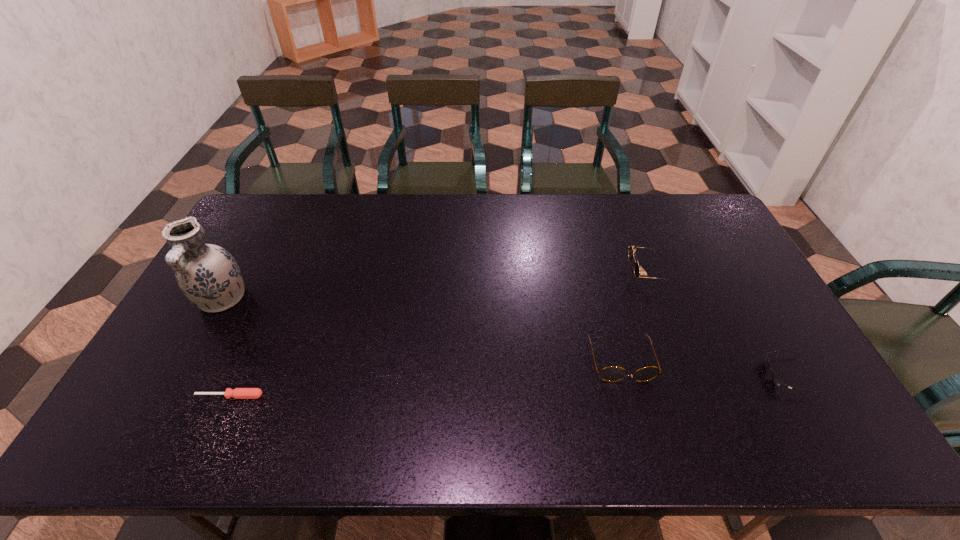
Find the location of a particular element. The width and height of the screenshot is (960, 540). free space at the near edge of the desktop is located at coordinates (204, 427).

In the image, there is a desktop. Identify the location of vacant space at the left edge. (168, 392).

The height and width of the screenshot is (540, 960). I want to click on free space at the right edge of the desktop, so click(x=686, y=244).

Where is `vacant region at the far right corner of the desktop`? The width and height of the screenshot is (960, 540). vacant region at the far right corner of the desktop is located at coordinates (702, 215).

I want to click on blank area at the near right corner, so click(847, 440).

Find the location of a particular element. This screenshot has width=960, height=540. empty location between the screwdriver and the leftmost sunglasses is located at coordinates (425, 378).

Identify the location of vacant point located between the screwdriver and the shortest sunglasses. (509, 386).

What are the coordinates of `free space between the screwdriver and the second shortest object` in the screenshot? It's located at (509, 386).

I want to click on free space between the vase and the farthest sunglasses, so click(x=436, y=286).

Locate an element on the screen. empty space that is in between the third object from left to right and the second sunglasses from right to left is located at coordinates pos(636,316).